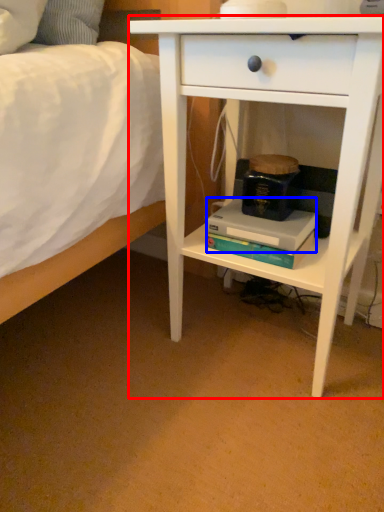
Question: Which of the following is the closest to the observer, nightstand (highlighted by a red box) or paperback book (highlighted by a blue box)?

Choices:
 (A) nightstand
 (B) paperback book

Answer: (A)